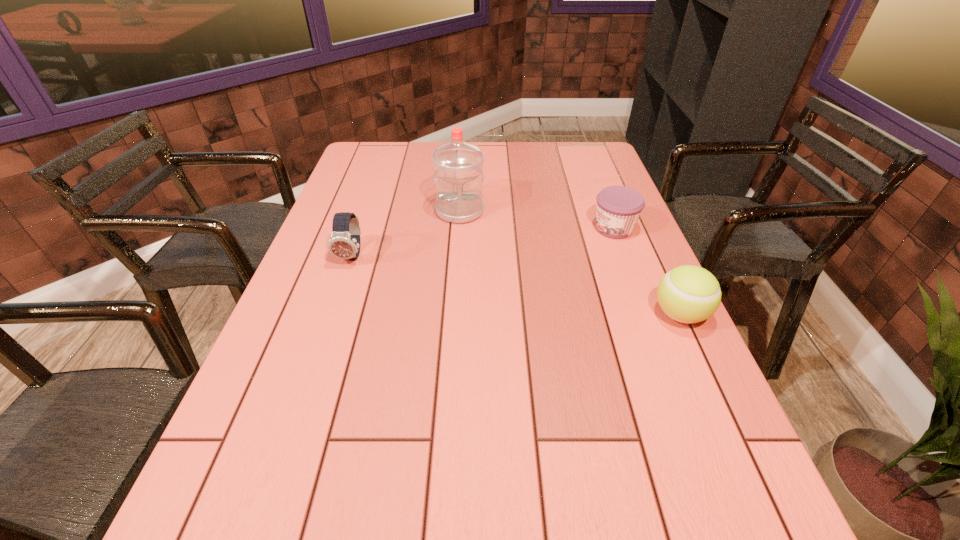
The image size is (960, 540). I want to click on vacant space on the desktop that is between the third farthest object and the nearest object and is positioned on the front label of the jam, so click(x=486, y=280).

What are the coordinates of `free space on the desktop that is between the leftmost object and the tennis ball and is positioned on the handle side of the second object from left to right` in the screenshot? It's located at (467, 276).